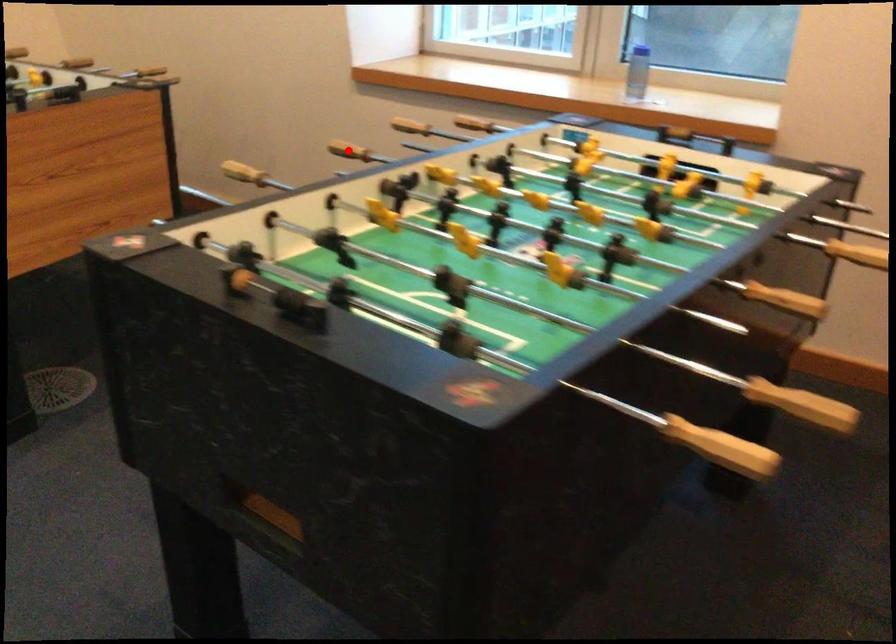
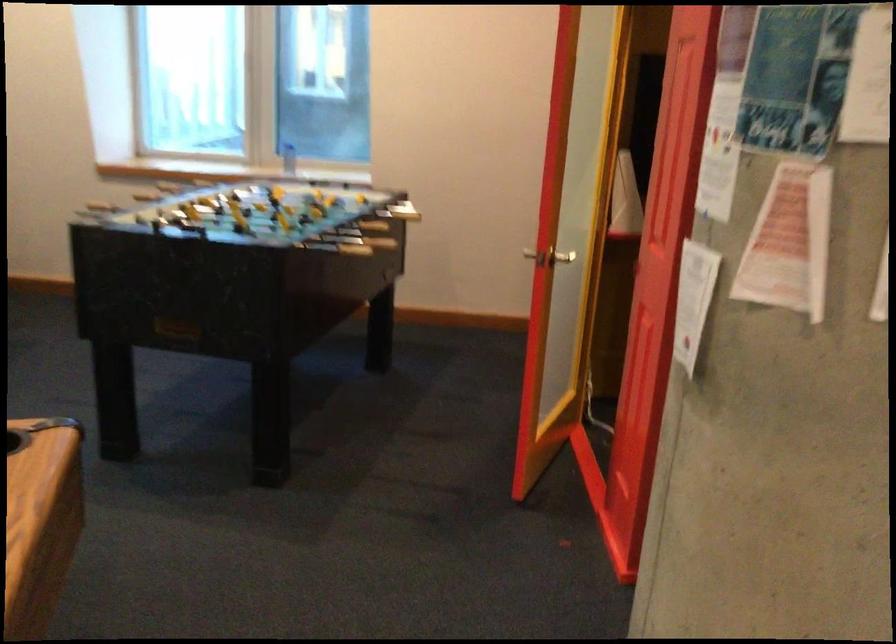
The point at the highlighted location is marked in the first image. Where is the corresponding point in the second image?

(147, 187)